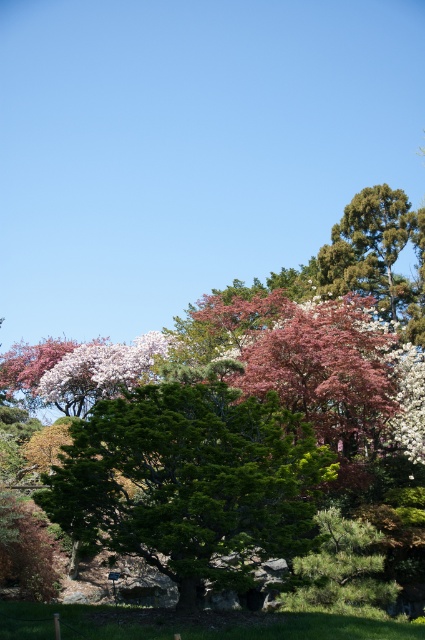
Question: Which is nearer to the green leafy tree at center?

Choices:
 (A) green textured tree at upper right
 (B) pink matte flower at center

Answer: (A)

Question: Does green textured tree at upper right appear under pink matte flower at center?

Choices:
 (A) no
 (B) yes

Answer: (A)

Question: Estimate the real-world distances between objects in this image. Which object is closer to the green leafy tree at center?

Choices:
 (A) green textured tree at upper right
 (B) pink matte flower at center

Answer: (A)

Question: Which point is closer to the camera taking this photo?

Choices:
 (A) (424, 228)
 (B) (116, 397)
 (C) (132, 372)

Answer: (B)

Question: Can you confirm if green leafy tree at center is bigger than pink matte flower at center?

Choices:
 (A) yes
 (B) no

Answer: (B)

Question: Is green textured tree at upper right thinner than pink matte flower at center?

Choices:
 (A) yes
 (B) no

Answer: (A)